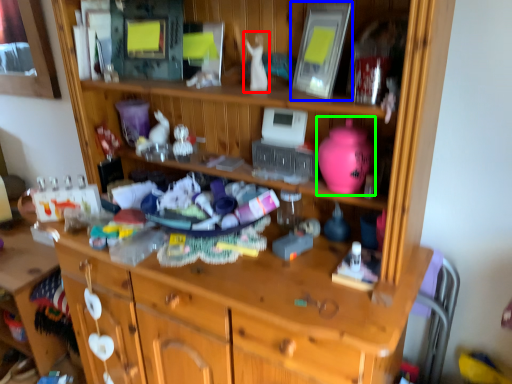
Question: Estimate the real-world distances between objects in this image. Which object is closer to toy (highlighted by a red box), picture frame (highlighted by a blue box) or toy (highlighted by a green box)?

Choices:
 (A) picture frame
 (B) toy

Answer: (A)